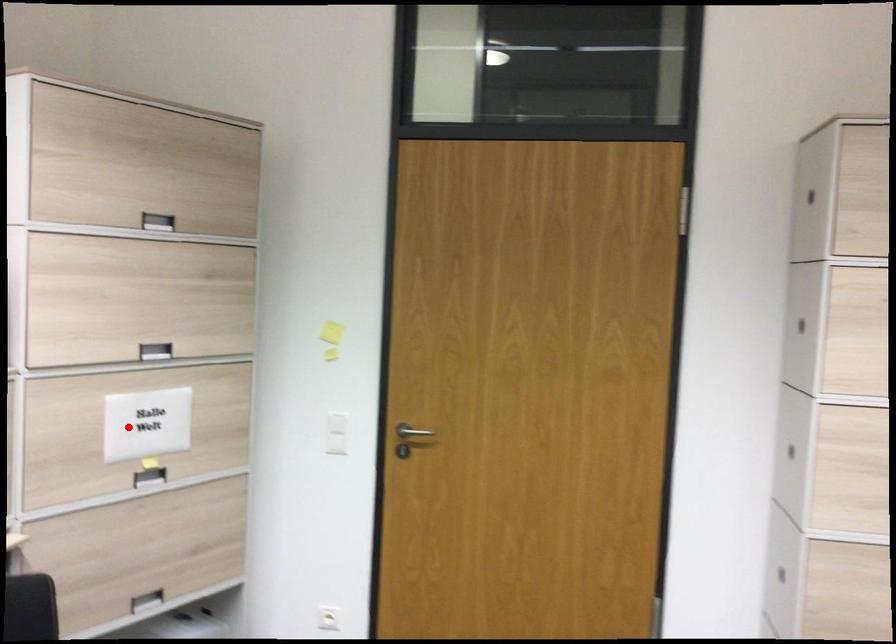
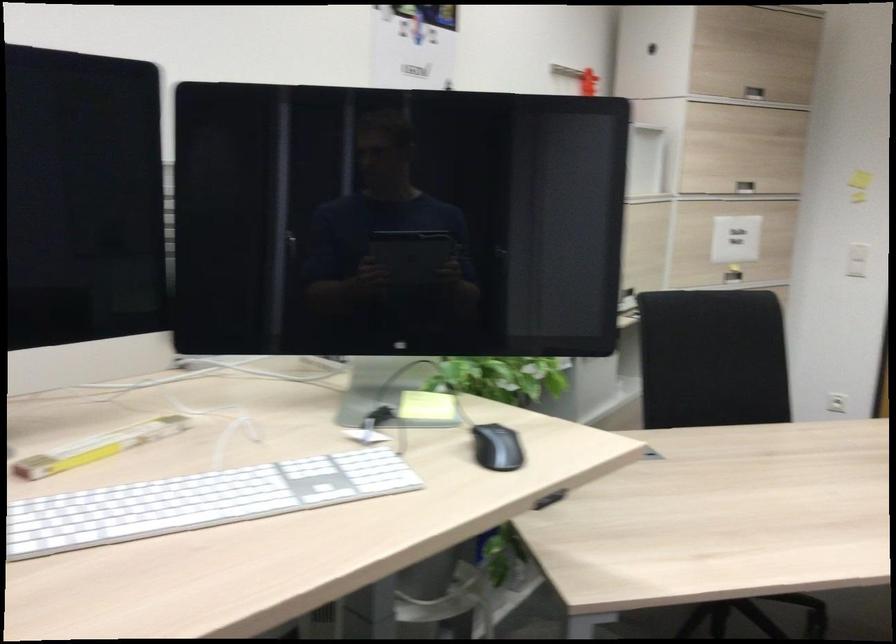
Where in the second image is the point corresponding to the highlighted location from the first image?

(736, 239)